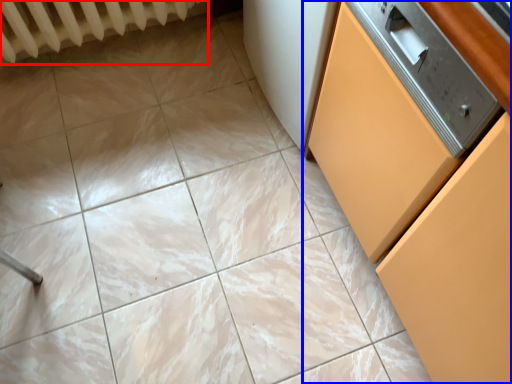
Question: Which of the following is the farthest to the observer, radiator (highlighted by a red box) or cabinetry (highlighted by a blue box)?

Choices:
 (A) radiator
 (B) cabinetry

Answer: (A)